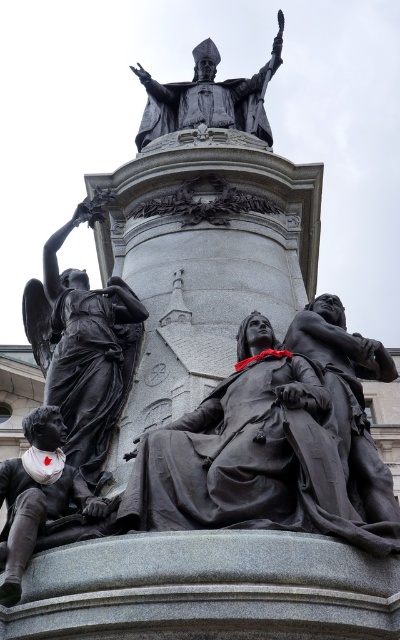
You are an art student analyzing the statue arrangement in the image. You notice the matte black statue at center and the bronze statue at lower left. Based on their positions, which statue is located to the right of the other?

The matte black statue at center is positioned on the right side of bronze statue at lower left, so the matte black statue at center is to the right of the bronze statue at lower left.

You are an art student analyzing the bronze statues in the image. You notice two statues labeled as the bronze statue at left and the bronze statue at upper center. Which of these two statues is located to the left of the other?

The bronze statue at left is positioned on the left side of the bronze statue at upper center.